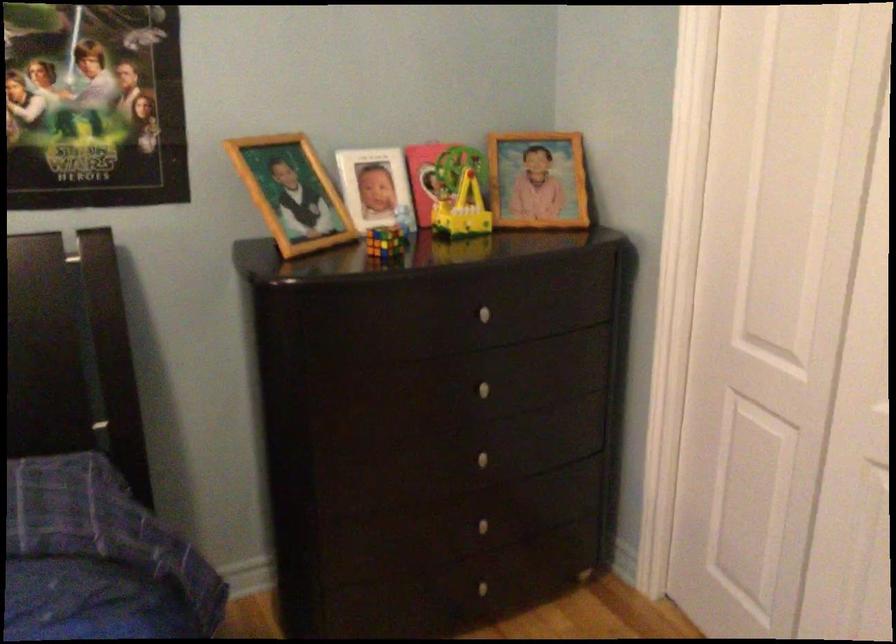
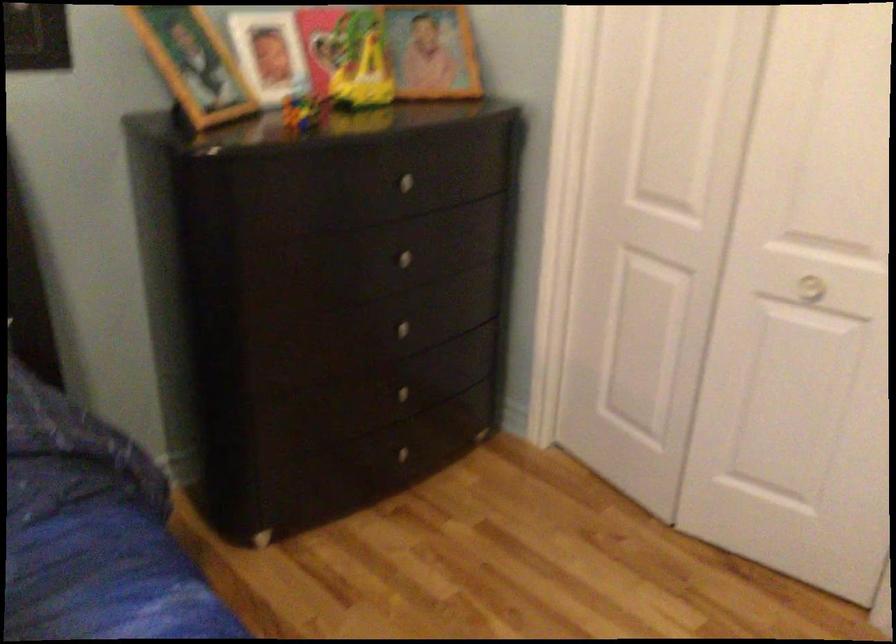
The point at [488,307] is marked in the first image. Where is the corresponding point in the second image?

(408, 178)